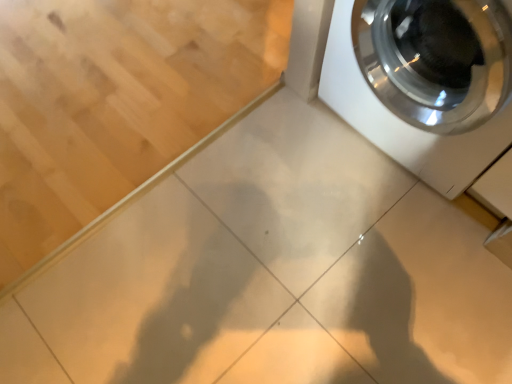
You are a GUI agent. You are given a task and a screenshot of the screen. Output one action in this format:
    pyautogui.click(x=<x>, y=<y>)
    Task: Click on the white glossy washing machine at lower right
    The image size is (512, 384).
    Given the screenshot: What is the action you would take?
    pyautogui.click(x=403, y=121)

Measure the distance between white glossy washing machine at lower right and camera.

white glossy washing machine at lower right is 38.80 inches away from camera.

What do you see at coordinates (403, 121) in the screenshot?
I see `white glossy washing machine at lower right` at bounding box center [403, 121].

You are a GUI agent. You are given a task and a screenshot of the screen. Output one action in this format:
    pyautogui.click(x=<x>, y=<y>)
    Task: Click on the white glossy washing machine at lower right
    
    Given the screenshot: What is the action you would take?
    point(403,121)